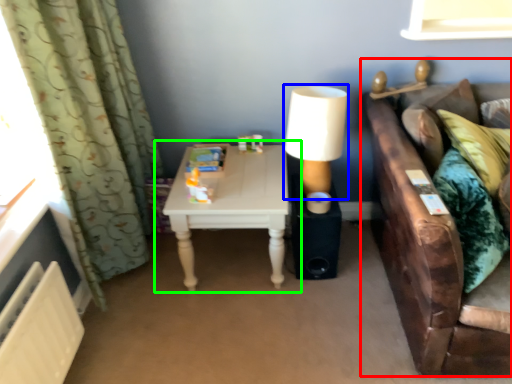
Question: Considering the real-world distances, which object is closest to studio couch (highlighted by a red box)? table lamp (highlighted by a blue box) or table (highlighted by a green box).

Choices:
 (A) table lamp
 (B) table

Answer: (A)